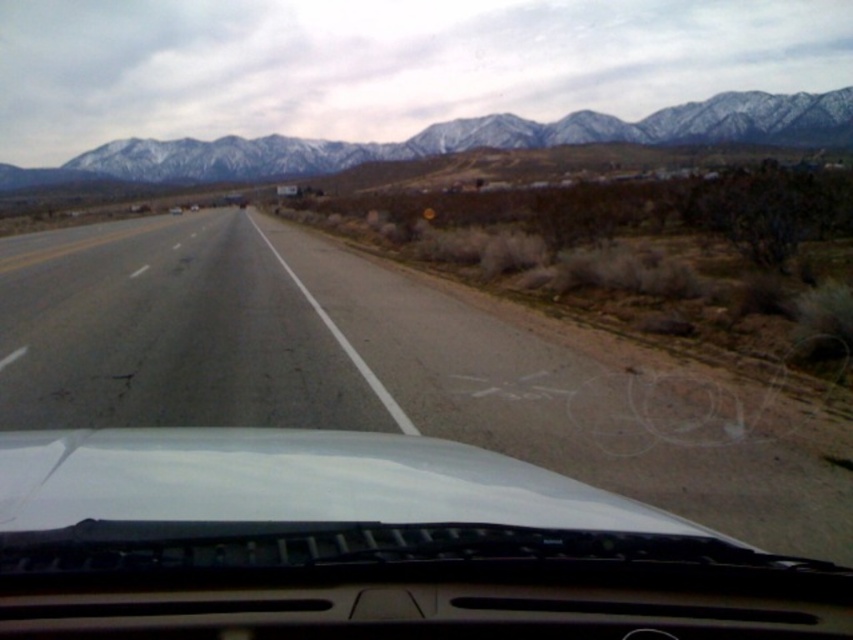
Question: Can you confirm if white matte windshield at center is wider than asphalt road at center?

Choices:
 (A) no
 (B) yes

Answer: (A)

Question: Can you confirm if asphalt road at center is thinner than snow-covered mountains at upper center?

Choices:
 (A) no
 (B) yes

Answer: (B)

Question: Which of these objects is positioned farthest from the snow-covered mountains at upper center?

Choices:
 (A) asphalt road at center
 (B) white matte windshield at center

Answer: (B)

Question: Which point appears closest to the camera in this image?

Choices:
 (A) (604, 419)
 (B) (701, 131)

Answer: (A)

Question: Considering the relative positions of asphalt road at center and snow-covered mountains at upper center in the image provided, where is asphalt road at center located with respect to snow-covered mountains at upper center?

Choices:
 (A) below
 (B) above

Answer: (A)

Question: Among these points, which one is nearest to the camera?

Choices:
 (A) (368, 275)
 (B) (115, 168)
 (C) (233, 600)

Answer: (C)